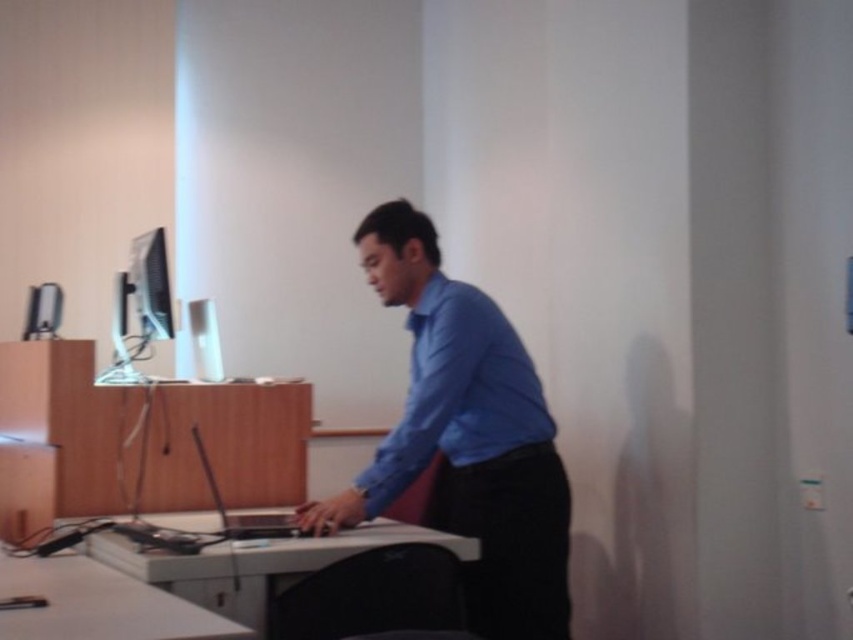
Who is lower down, blue smooth shirt at center or matte black monitor at left?

blue smooth shirt at center is lower down.

Is blue smooth shirt at center closer to camera compared to matte black monitor at left?

That is True.

Find the location of a particular element. blue smooth shirt at center is located at coordinates (465, 436).

Which of these two, blue smooth dress shirt at center or matte black monitor at left, stands taller?

With more height is blue smooth dress shirt at center.

Is point (465, 388) closer to camera compared to point (149, 280)?

Yes, point (465, 388) is in front of point (149, 280).

The image size is (853, 640). Describe the element at coordinates (457, 392) in the screenshot. I see `blue smooth dress shirt at center` at that location.

The height and width of the screenshot is (640, 853). I want to click on blue smooth dress shirt at center, so click(457, 392).

Is blue smooth shirt at center wider than blue smooth dress shirt at center?

Correct, the width of blue smooth shirt at center exceeds that of blue smooth dress shirt at center.

Is blue smooth shirt at center thinner than blue smooth dress shirt at center?

No, blue smooth shirt at center is not thinner than blue smooth dress shirt at center.

Is point (370, 252) positioned behind point (407, 433)?

Yes, point (370, 252) is farther from viewer.

The height and width of the screenshot is (640, 853). I want to click on blue smooth shirt at center, so click(x=465, y=436).